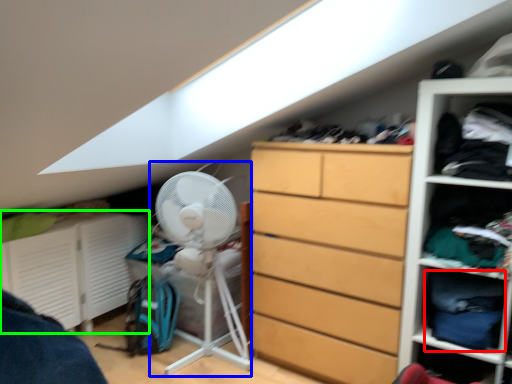
Question: Estimate the real-world distances between objects in this image. Which object is farther from clothing (highlighted by a red box), fan (highlighted by a blue box) or cabinet (highlighted by a green box)?

Choices:
 (A) fan
 (B) cabinet

Answer: (B)